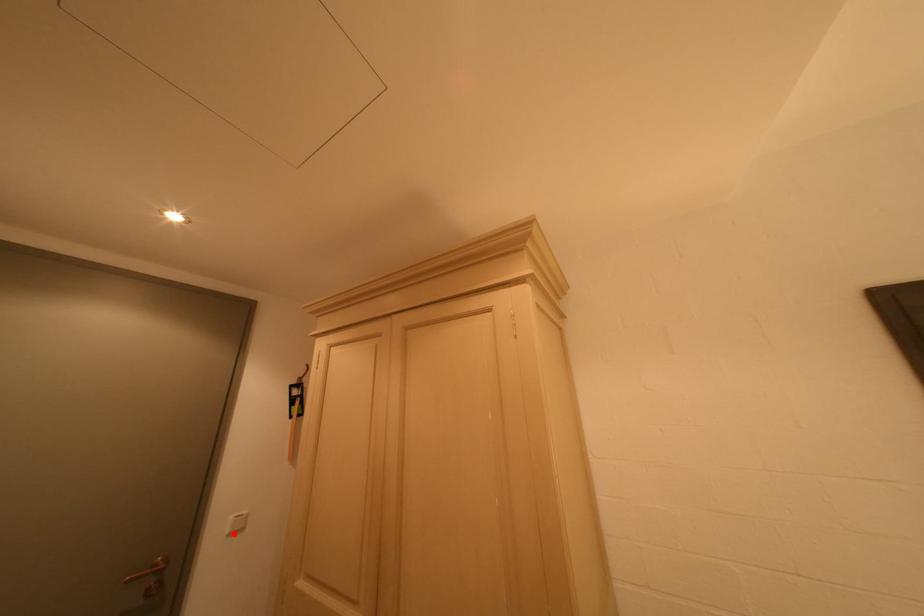
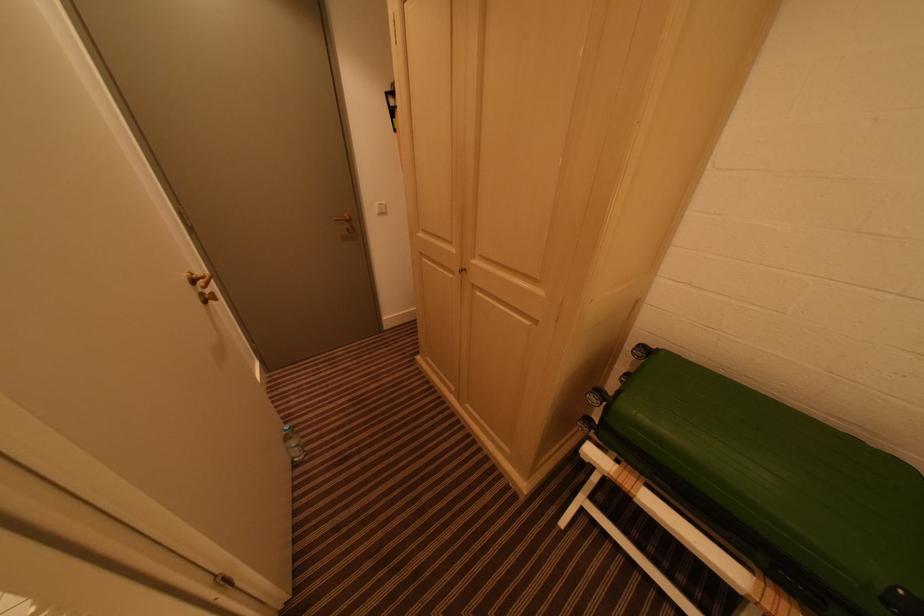
The point at the highlighted location is marked in the first image. Where is the corresponding point in the second image?

(383, 214)